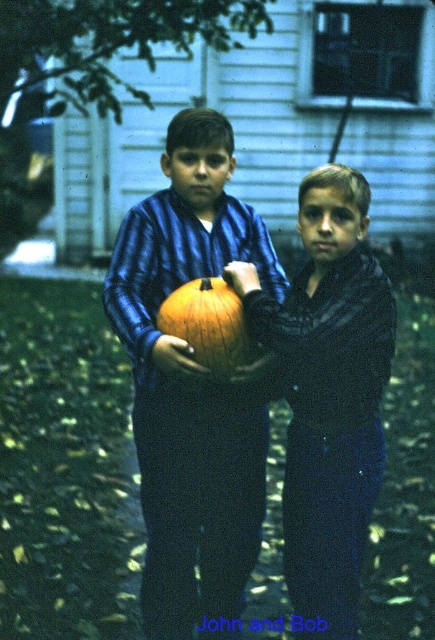
Question: Is matte black jacket at center thinner than orange matte pumpkin at center?

Choices:
 (A) no
 (B) yes

Answer: (A)

Question: Which object appears farthest from the camera in this image?

Choices:
 (A) orange matte pumpkin at center
 (B) matte black jacket at center
 (C) blue striped shirt at center

Answer: (C)

Question: Is matte black jacket at center wider than orange matte pumpkin at center?

Choices:
 (A) no
 (B) yes

Answer: (B)

Question: Is blue striped shirt at center positioned behind orange matte pumpkin at center?

Choices:
 (A) yes
 (B) no

Answer: (A)

Question: Which point is closer to the camera taking this photo?

Choices:
 (A) (194, 284)
 (B) (243, 547)
 (C) (388, 324)

Answer: (C)

Question: Which object appears closest to the camera in this image?

Choices:
 (A) blue striped shirt at center
 (B) matte black jacket at center

Answer: (B)